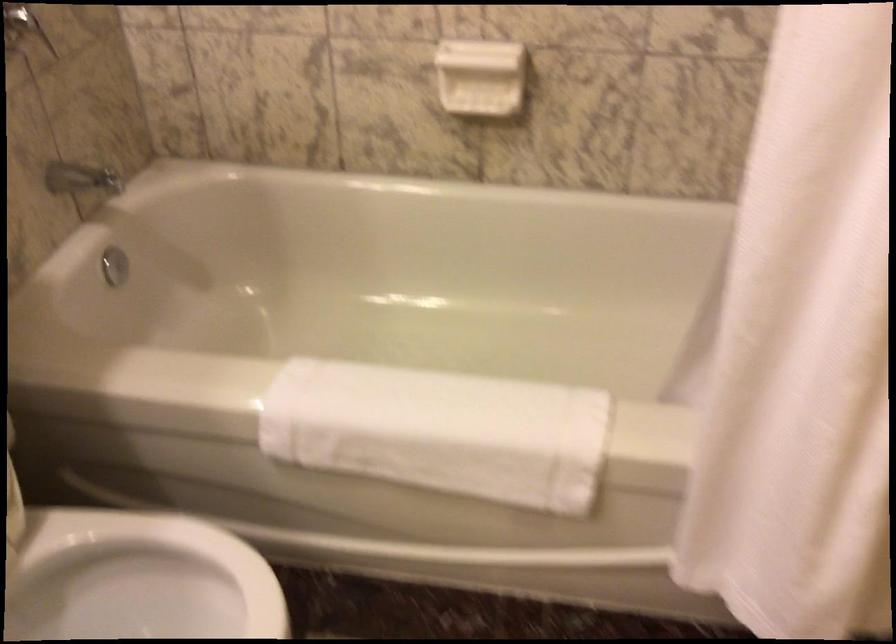
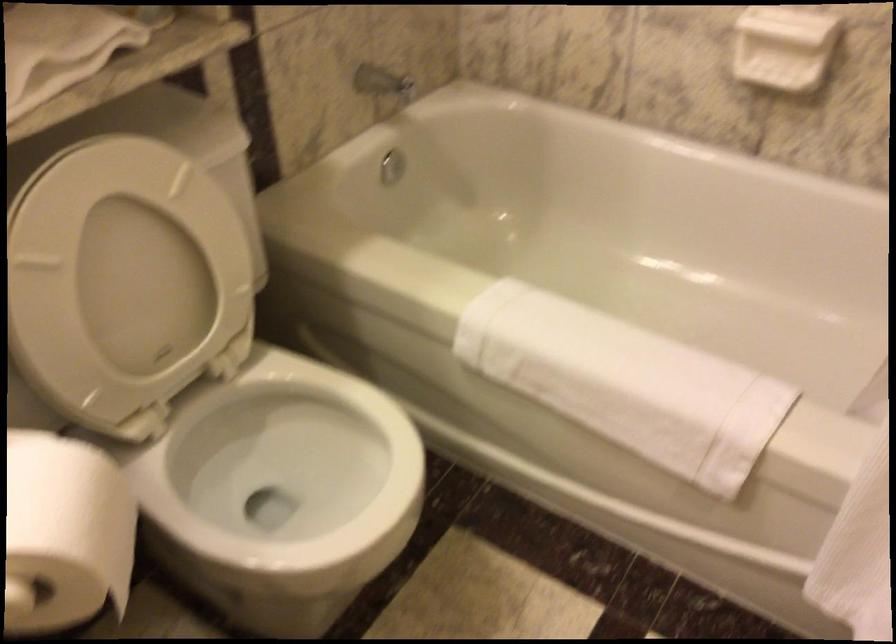
Locate, in the second image, the point that corresponds to [452,431] in the first image.

(625, 383)